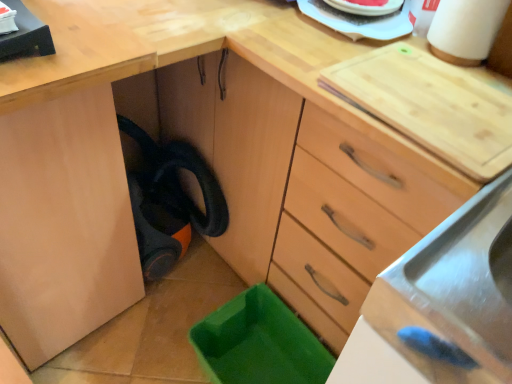
Question: Is the depth of white matte paper towel at upper right greater than that of stainless steel sink at lower right?

Choices:
 (A) yes
 (B) no

Answer: (A)

Question: Is white matte paper towel at upper right bigger than stainless steel sink at lower right?

Choices:
 (A) yes
 (B) no

Answer: (B)

Question: Is white matte paper towel at upper right looking in the opposite direction of stainless steel sink at lower right?

Choices:
 (A) no
 (B) yes

Answer: (A)

Question: From the image's perspective, is white matte paper towel at upper right beneath stainless steel sink at lower right?

Choices:
 (A) no
 (B) yes

Answer: (A)

Question: Considering the relative sizes of white matte paper towel at upper right and stainless steel sink at lower right in the image provided, is white matte paper towel at upper right smaller than stainless steel sink at lower right?

Choices:
 (A) yes
 (B) no

Answer: (A)

Question: Is white matte paper towel at upper right not within stainless steel sink at lower right?

Choices:
 (A) no
 (B) yes

Answer: (B)

Question: Considering the relative sizes of stainless steel sink at lower right and white matte paper towel at upper right in the image provided, is stainless steel sink at lower right thinner than white matte paper towel at upper right?

Choices:
 (A) no
 (B) yes

Answer: (A)

Question: Is stainless steel sink at lower right bigger than white matte paper towel at upper right?

Choices:
 (A) yes
 (B) no

Answer: (A)

Question: Does stainless steel sink at lower right have a greater width compared to white matte paper towel at upper right?

Choices:
 (A) no
 (B) yes

Answer: (B)

Question: Is white matte paper towel at upper right at the back of stainless steel sink at lower right?

Choices:
 (A) yes
 (B) no

Answer: (B)

Question: Does stainless steel sink at lower right turn towards white matte paper towel at upper right?

Choices:
 (A) no
 (B) yes

Answer: (A)

Question: Can you confirm if stainless steel sink at lower right is taller than white matte paper towel at upper right?

Choices:
 (A) yes
 (B) no

Answer: (B)

Question: Is white matte paper towel at upper right inside the boundaries of stainless steel sink at lower right, or outside?

Choices:
 (A) outside
 (B) inside

Answer: (A)